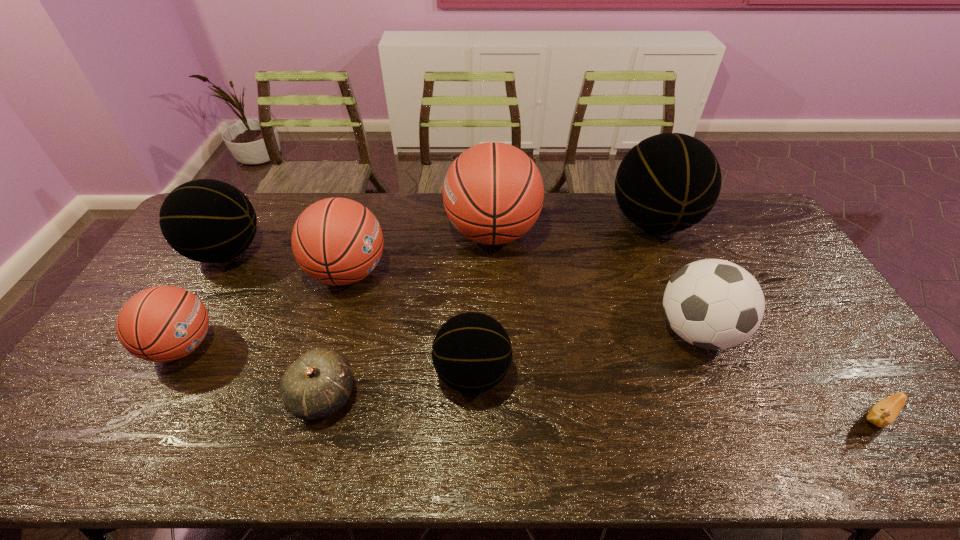
This screenshot has width=960, height=540. I want to click on the leftmost orange basketball, so click(x=164, y=323).

Locate an element on the screen. This screenshot has height=540, width=960. the eighth tallest object is located at coordinates (317, 384).

Where is `banana`? The image size is (960, 540). banana is located at coordinates (883, 413).

In order to click on yellow banana in this screenshot , I will do `click(883, 413)`.

Find the location of a particular element. This screenshot has width=960, height=540. free location located on the right of the rightmost black basketball is located at coordinates (758, 222).

Locate an element on the screen. free space located on the logo side of the rightmost orange basketball is located at coordinates (403, 233).

Identify the location of vacant space located on the logo side of the rightmost orange basketball. Image resolution: width=960 pixels, height=540 pixels. (347, 233).

The height and width of the screenshot is (540, 960). In order to click on free spot located on the logo side of the rightmost orange basketball in this screenshot , I will do `click(349, 233)`.

Where is `vacant region located on the right of the second smallest black basketball`? The width and height of the screenshot is (960, 540). vacant region located on the right of the second smallest black basketball is located at coordinates (301, 252).

I want to click on free space located on the logo side of the second biggest orange basketball, so [447, 272].